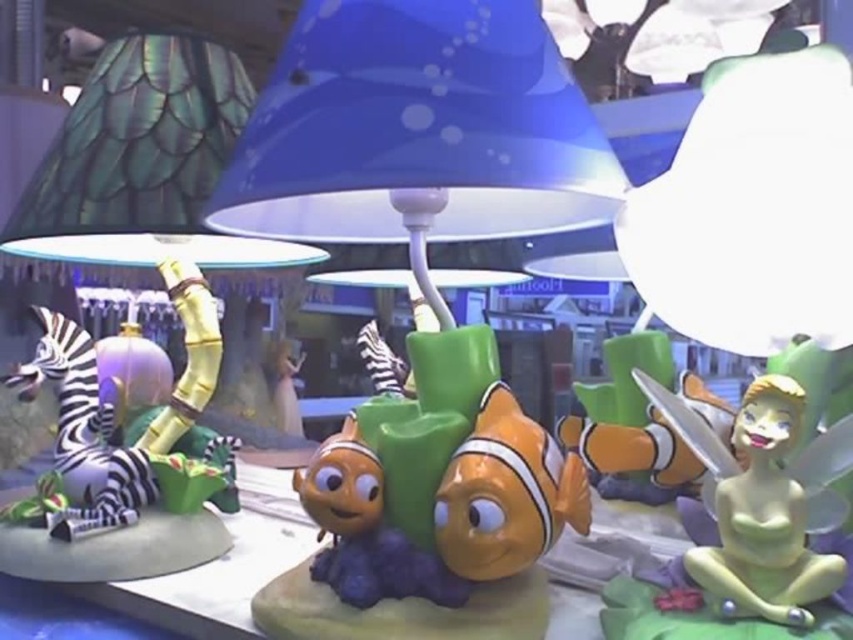
Is green rubber tinker bell at lower right above orange matte clownfish at center?

Correct, green rubber tinker bell at lower right is located above orange matte clownfish at center.

Between green rubber tinker bell at lower right and orange matte clownfish at center, which one is positioned lower?

orange matte clownfish at center is lower down.

Identify the location of green rubber tinker bell at lower right. The image size is (853, 640). [769, 508].

Is point (508, 456) closer to camera compared to point (349, 456)?

Yes, it is in front of point (349, 456).

Based on the photo, can you confirm if orange matte clownfish at center is thinner than shiny orange fish at center?

Yes, orange matte clownfish at center is thinner than shiny orange fish at center.

Is point (509, 477) more distant than point (393, 570)?

No, it is not.

Locate an element on the screen. orange matte clownfish at center is located at coordinates (506, 492).

Is green rubber tinker bell at lower right to the left of shiny orange fish at center from the viewer's perspective?

No, green rubber tinker bell at lower right is not to the left of shiny orange fish at center.

Which is in front, point (747, 460) or point (383, 531)?

Point (747, 460) is in front.

Who is more distant from viewer, (693, 424) or (364, 497)?

Positioned behind is point (364, 497).

The width and height of the screenshot is (853, 640). In order to click on green rubber tinker bell at lower right in this screenshot , I will do `click(769, 508)`.